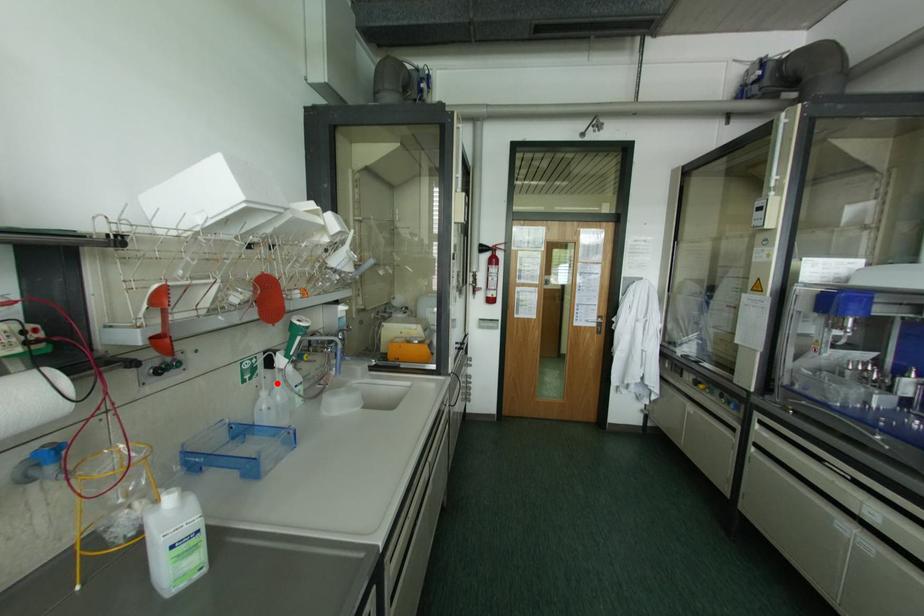
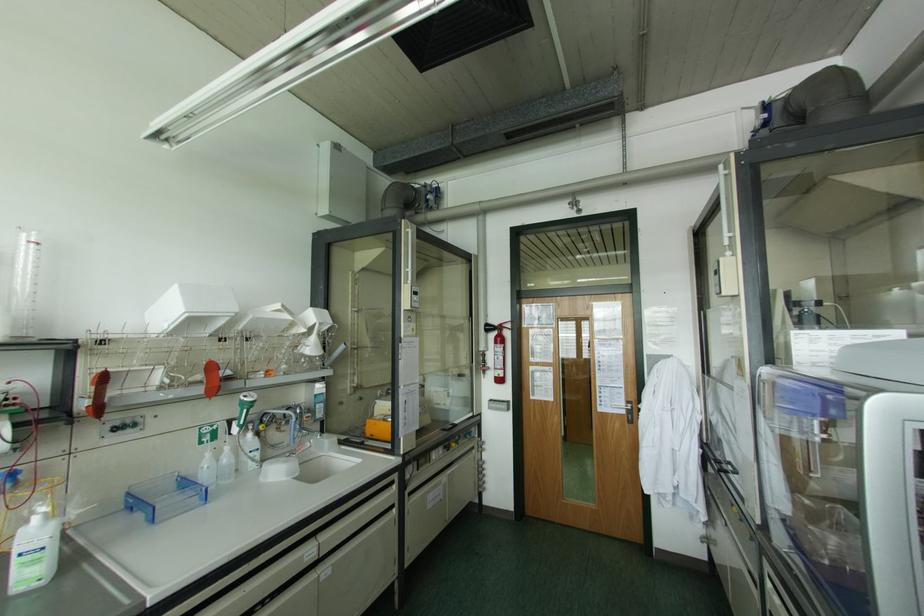
Where in the second image is the point corresponding to the highlighted location from the first image?

(226, 448)